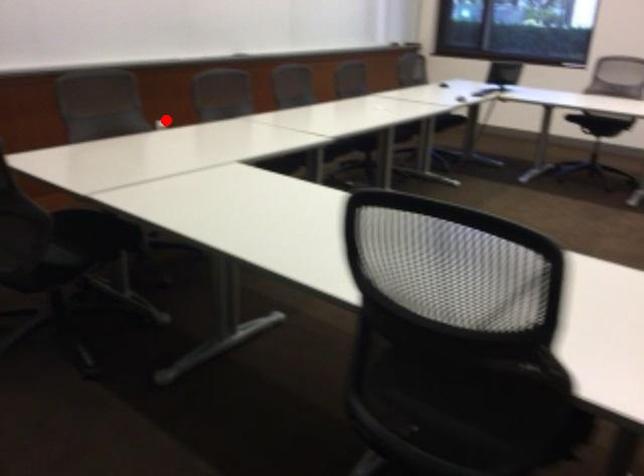
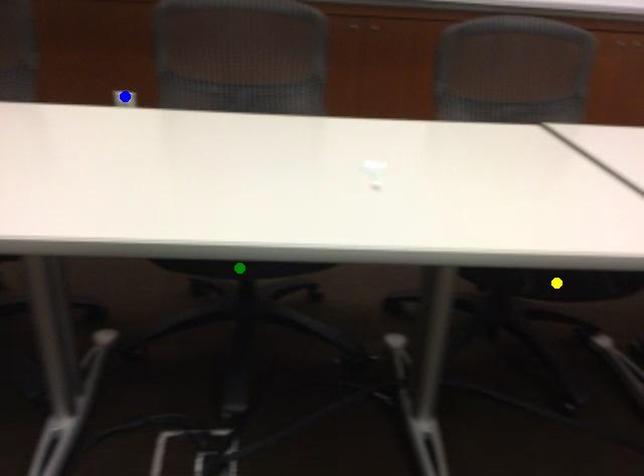
Question: I am providing you with two images of the same scene from different viewpoints. A red point is marked on the first image. You are given multiple points on the second image. Which spot in image 2 lines up with the point in image 1?

Choices:
 (A) blue point
 (B) yellow point
 (C) green point

Answer: (A)